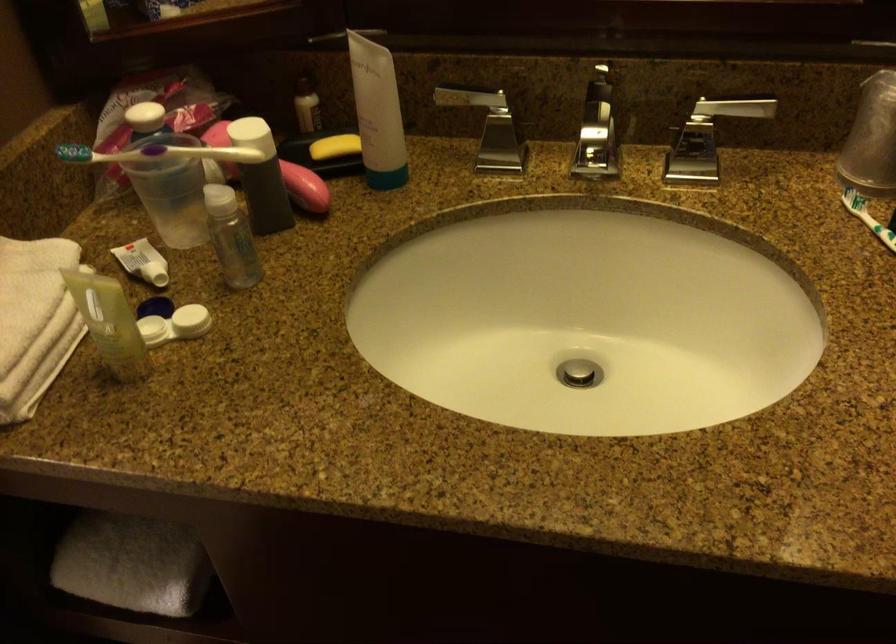
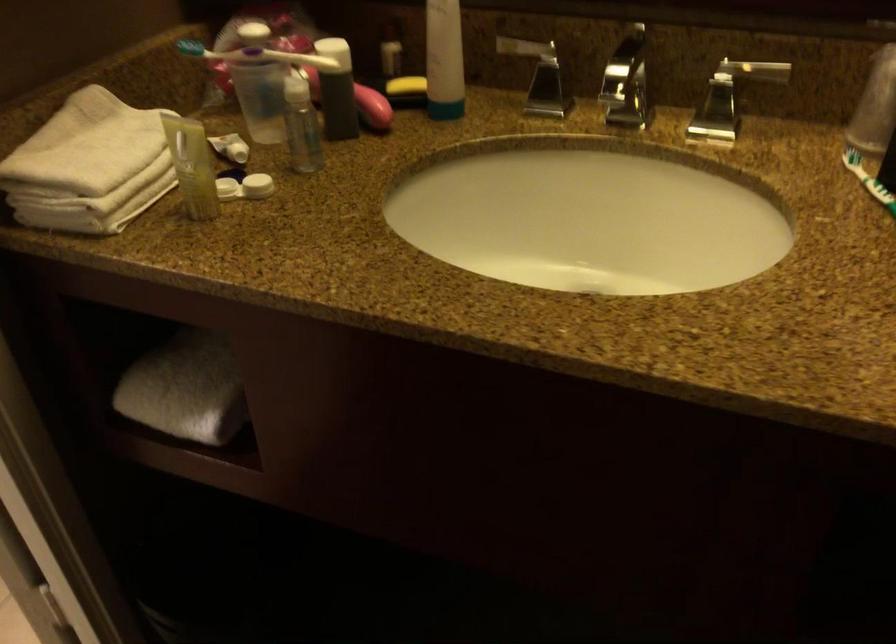
The point at (263, 180) is marked in the first image. Where is the corresponding point in the second image?

(337, 90)